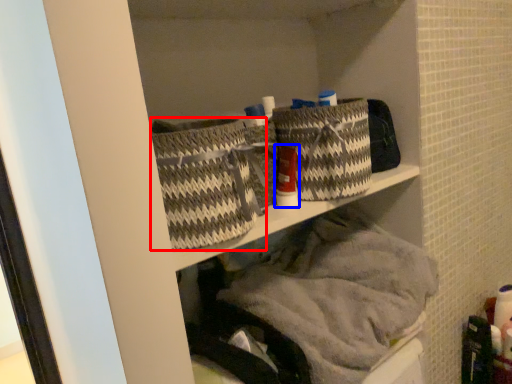
Question: Which object appears closest to the camera in this image, basket (highlighted by a red box) or toiletry (highlighted by a blue box)?

Choices:
 (A) basket
 (B) toiletry

Answer: (A)